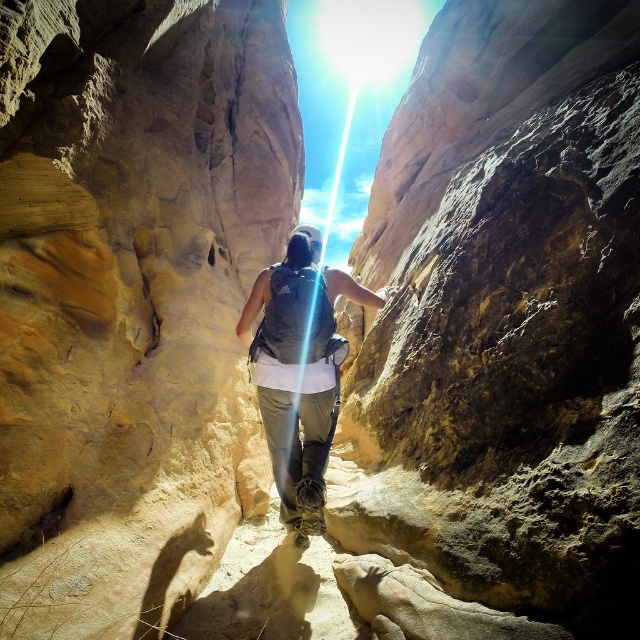
You are a hiker planning to climb the rustic sandstone boulder at center and the yellow sandstone rock face at center. Which one do you think requires more effort due to its height?

The rustic sandstone boulder at center is taller than the yellow sandstone rock face at center, so it would require more effort to climb.

You are a hiker in the slot canyon and want to touch the yellow sandstone rock face at center. If you reach your hand out from where you are standing, will your hand be able to reach the point at coordinates (131, 296)?

The point at coordinates (131, 296) is on the yellow sandstone rock face at center, so yes, your hand can reach it by extending your arm towards the rock face.

You are the hiker in the image and want to place your matte gray backpack at center on top of the rustic sandstone boulder at center. Is this possible given their positions?

The rustic sandstone boulder at center is above the matte gray backpack at center, so the backpack is already positioned below the boulder. To place the backpack on top, you would need to move it upwards, but since the boulder is already above, it might not be feasible unless there is a stable surface or the backpack can be lifted vertically.